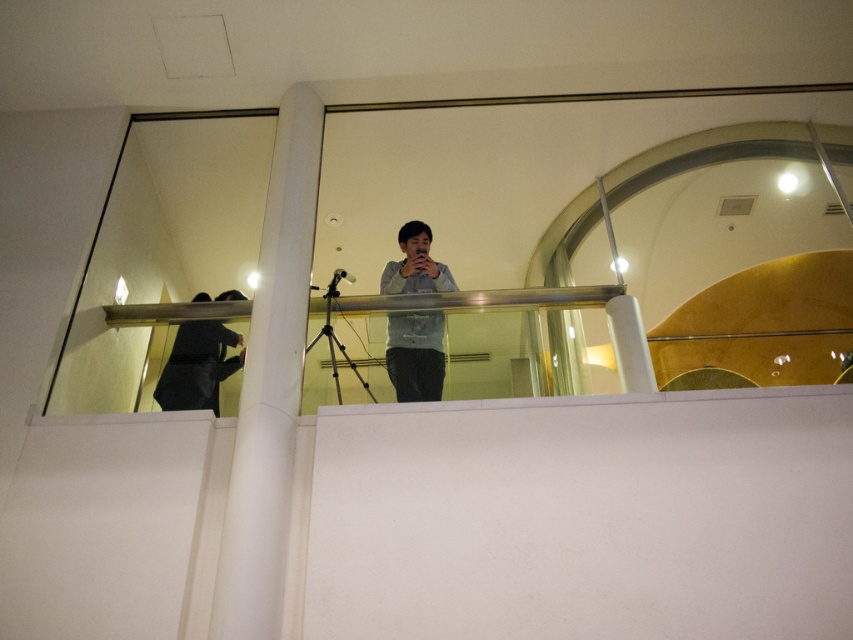
Does light blue shirt at center have a greater width compared to dark gray fabric at upper center?

No, light blue shirt at center is not wider than dark gray fabric at upper center.

This screenshot has width=853, height=640. What are the coordinates of `light blue shirt at center` in the screenshot? It's located at (415, 355).

Does white smooth pillar at center come in front of metallic tripod at center?

→ Yes, white smooth pillar at center is closer to the viewer.

Does white smooth pillar at center have a larger size compared to metallic tripod at center?

Indeed, white smooth pillar at center has a larger size compared to metallic tripod at center.

Identify the location of white smooth pillar at center. This screenshot has height=640, width=853. (270, 385).

Who is positioned more to the right, light blue shirt at center or metallic tripod at center?

light blue shirt at center

Can you confirm if light blue shirt at center is positioned below metallic tripod at center?

Actually, light blue shirt at center is above metallic tripod at center.

Where is `light blue shirt at center`? This screenshot has width=853, height=640. light blue shirt at center is located at coordinates (415, 355).